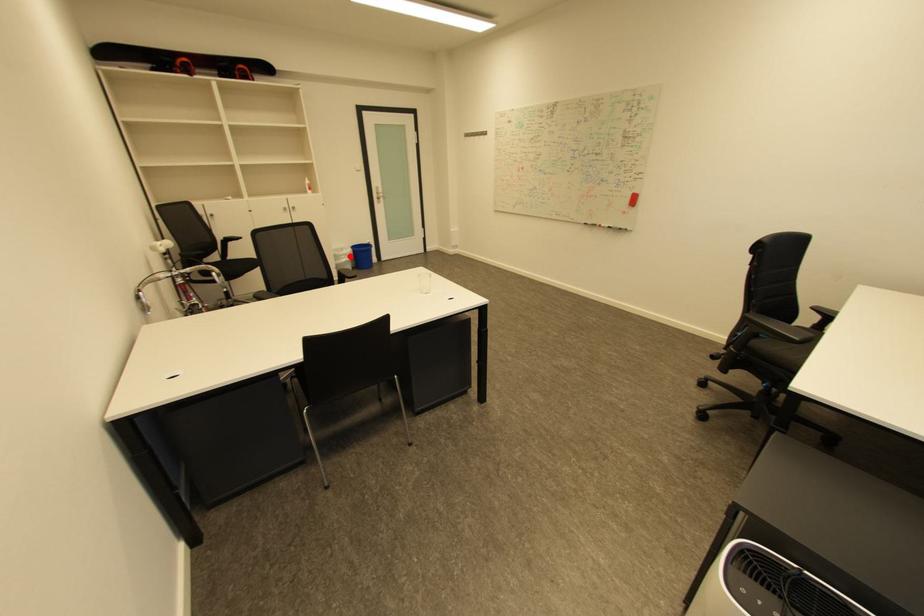
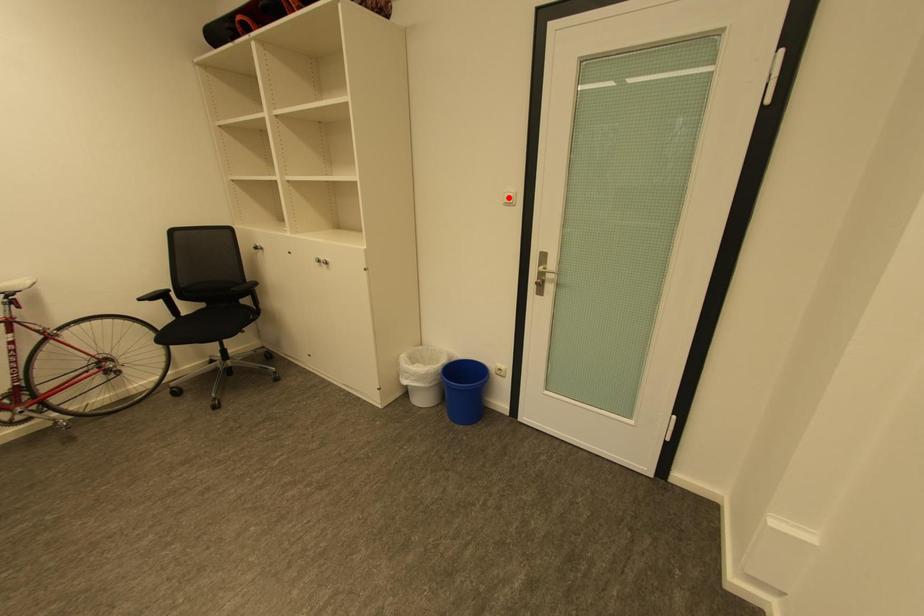
I am providing you with two images of the same scene from different viewpoints. A red point is marked on the first image and another point is marked on the second image. Does the point marked in image1 correspond to the same location as the one in image2?

No